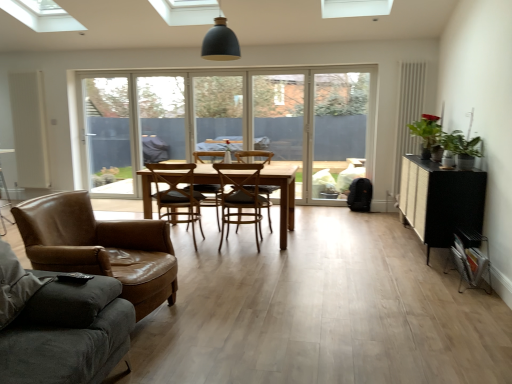
Identify the location of free space in front of light brown wooden table at center. This screenshot has width=512, height=384. (258, 270).